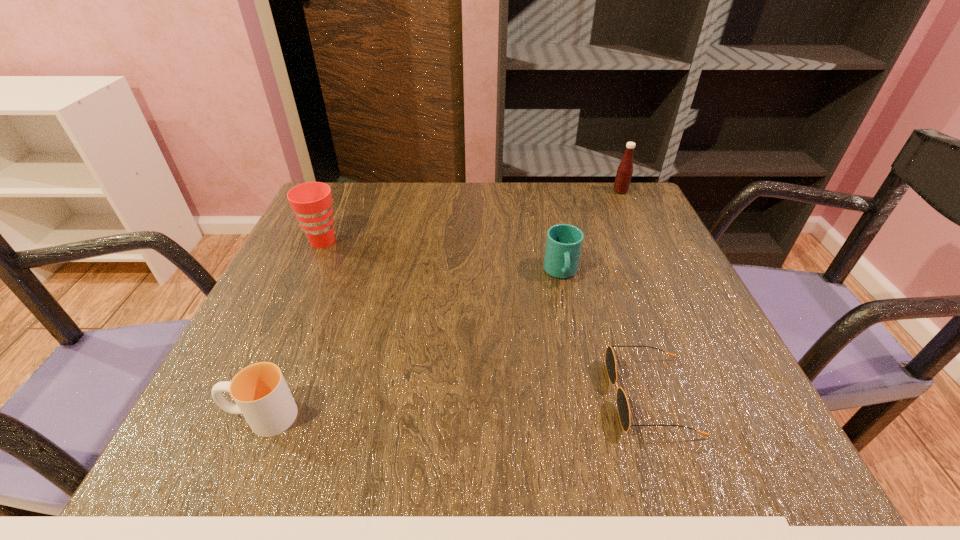
Identify the location of free region at the near left corner. (180, 458).

In the image, there is a desktop. Identify the location of free space at the far right corner. Image resolution: width=960 pixels, height=540 pixels. (648, 210).

Where is `empty space that is in between the sunglasses and the Tabasco sauce`? The width and height of the screenshot is (960, 540). empty space that is in between the sunglasses and the Tabasco sauce is located at coordinates (636, 294).

Where is `free space between the shortest object and the nearest cup`? This screenshot has width=960, height=540. free space between the shortest object and the nearest cup is located at coordinates (456, 406).

This screenshot has width=960, height=540. What are the coordinates of `vacant space in between the nearest cup and the rightmost cup` in the screenshot? It's located at (412, 345).

At what (x,y) coordinates should I click in order to perform the action: click on vacant area that lies between the Tabasco sauce and the nearest cup. Please return your answer as a coordinate pair (x, y). The image size is (960, 540). Looking at the image, I should click on (442, 304).

What are the coordinates of `free space between the nearest cup and the shortest object` in the screenshot? It's located at (456, 406).

The height and width of the screenshot is (540, 960). Find the location of `empty location between the nearest cup and the third farthest object`. empty location between the nearest cup and the third farthest object is located at coordinates (412, 345).

Identify the location of unoccupied position between the shortest object and the rightmost cup. (606, 334).

Locate an element on the screen. This screenshot has width=960, height=540. vacant area that lies between the nearest cup and the Tabasco sauce is located at coordinates (442, 304).